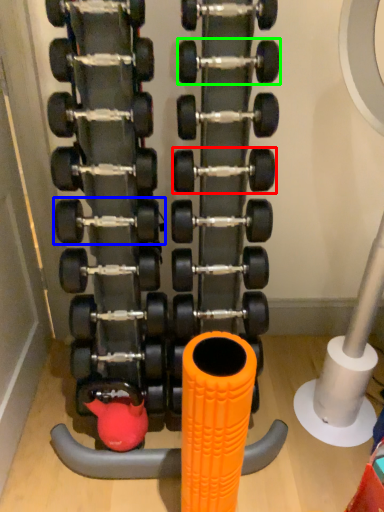
Question: Based on their relative distances, which object is nearer to dumbbell (highlighted by a red box)? Choose from dumbbell (highlighted by a blue box) and dumbbell (highlighted by a green box).

Choices:
 (A) dumbbell
 (B) dumbbell

Answer: (B)